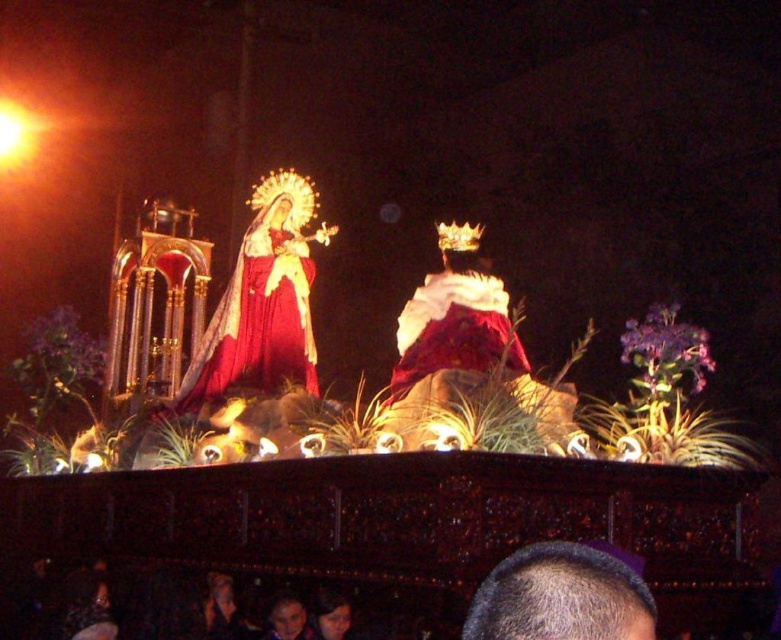
Which of these two, matte gold statue at upper left or white velvet robe at center, stands taller?

With more height is matte gold statue at upper left.

How distant is matte gold statue at upper left from white velvet robe at center?

20.88 meters

Who is more forward, [227,392] or [505,365]?

Positioned in front is point [505,365].

This screenshot has height=640, width=781. In order to click on matte gold statue at upper left in this screenshot , I will do `click(262, 304)`.

Is point (516, 563) farther from viewer compared to point (471, 289)?

No, it is not.

Who is positioned more to the left, gray hair at upper center or white velvet robe at center?

white velvet robe at center

Image resolution: width=781 pixels, height=640 pixels. I want to click on gray hair at upper center, so click(562, 596).

Can you confirm if matte gold statue at upper left is bigger than gray hair at upper center?

Yes.

Is point (300, 326) closer to viewer compared to point (610, 612)?

No.

Which is in front, point (251, 221) or point (466, 637)?

Point (466, 637) is more forward.

In order to click on matte gold statue at upper left in this screenshot , I will do `click(262, 304)`.